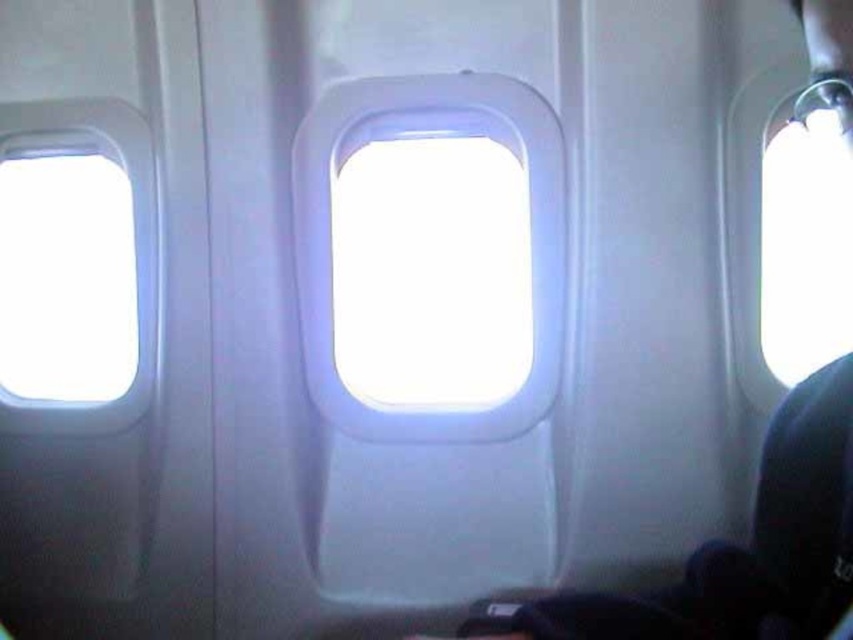
You are sitting in an airplane seat and want to look out the window. You notice two windows in front of you. One is the transparent plastic airplane window at center and the other is the transparent glass airplane window at left. Which window is positioned to the right of the other?

The transparent plastic airplane window at center is positioned to the right of the transparent glass airplane window at left.

You are sitting in an airplane seat and want to look out the window. You notice two windows in front of you. Which window, the transparent plastic airplane window at center or the transparent glass airplane window at left, is taller?

The transparent plastic airplane window at center is taller than the transparent glass airplane window at left.

You are sitting in an airplane seat and want to look out the transparent plastic airplane window at center. However, you notice the transparent glass airplane window at left is blocking your view. Which window should you move towards to get an unobstructed view?

The transparent plastic airplane window at center is in front of the transparent glass airplane window at left, so you should move towards the transparent plastic airplane window at center to get an unobstructed view.